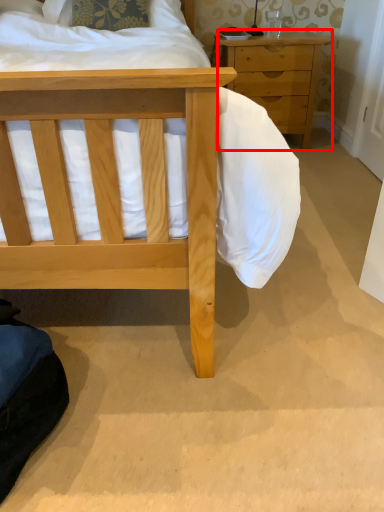
Question: From the image's perspective, where is chest of drawers (annotated by the red box) located in relation to pillow in the image?

Choices:
 (A) below
 (B) above

Answer: (A)